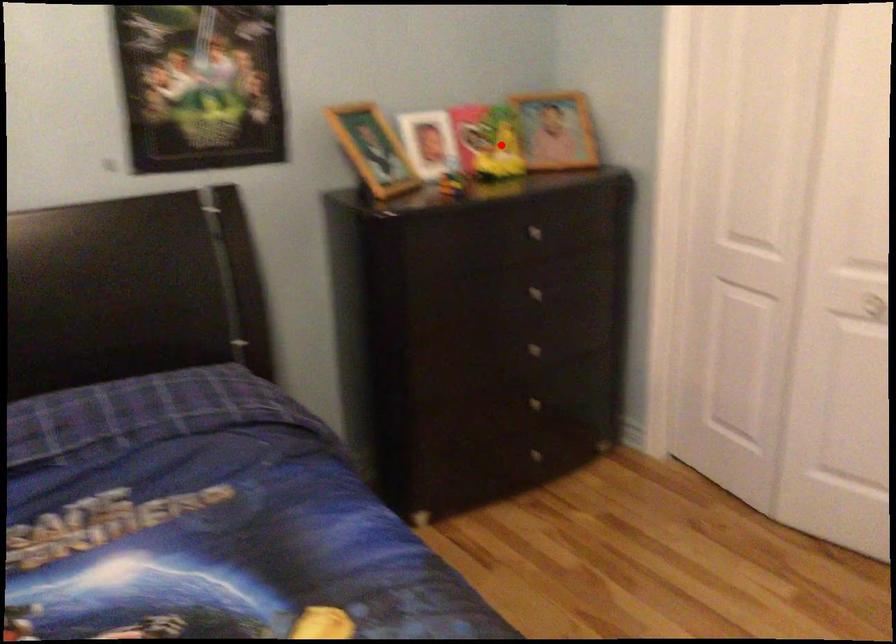
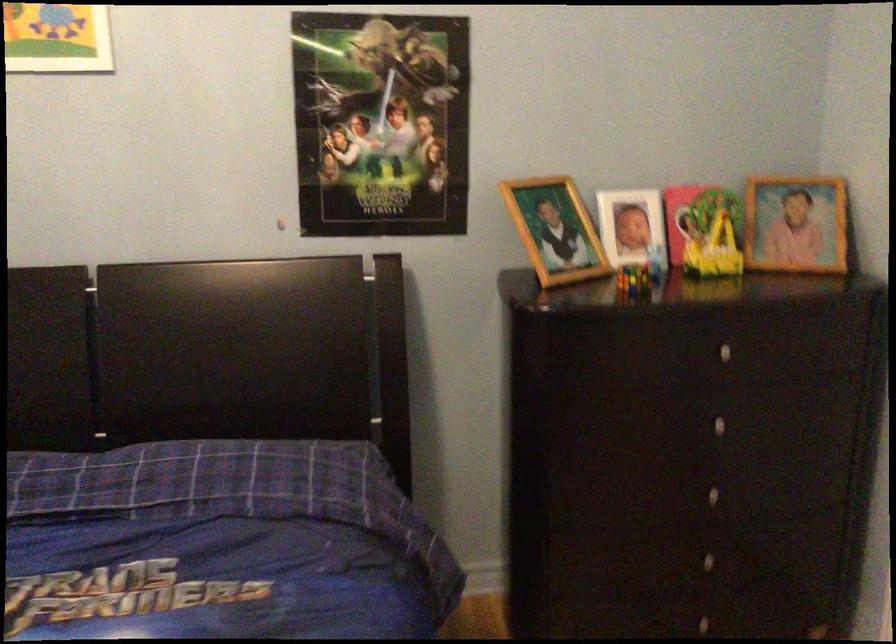
The point at the highlighted location is marked in the first image. Where is the corresponding point in the second image?

(719, 240)